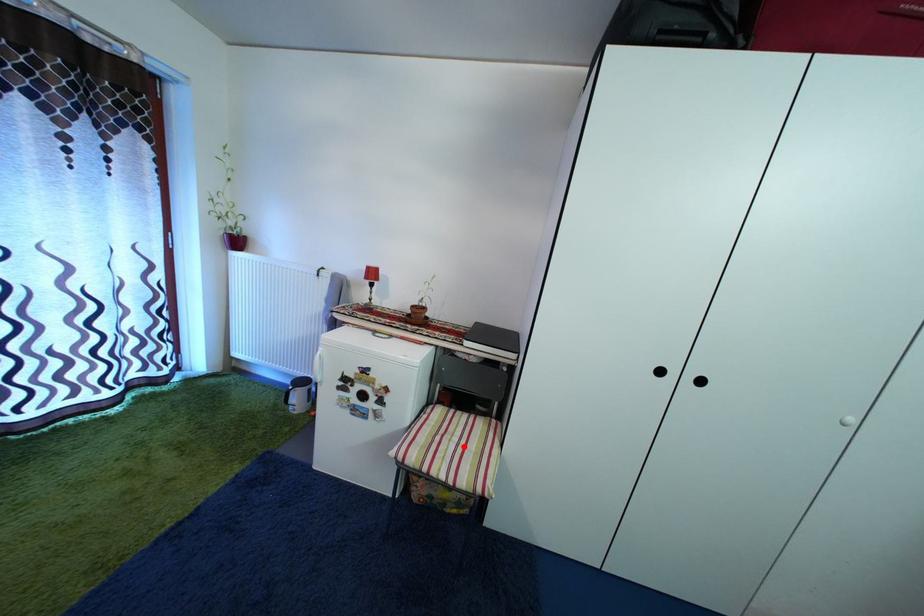
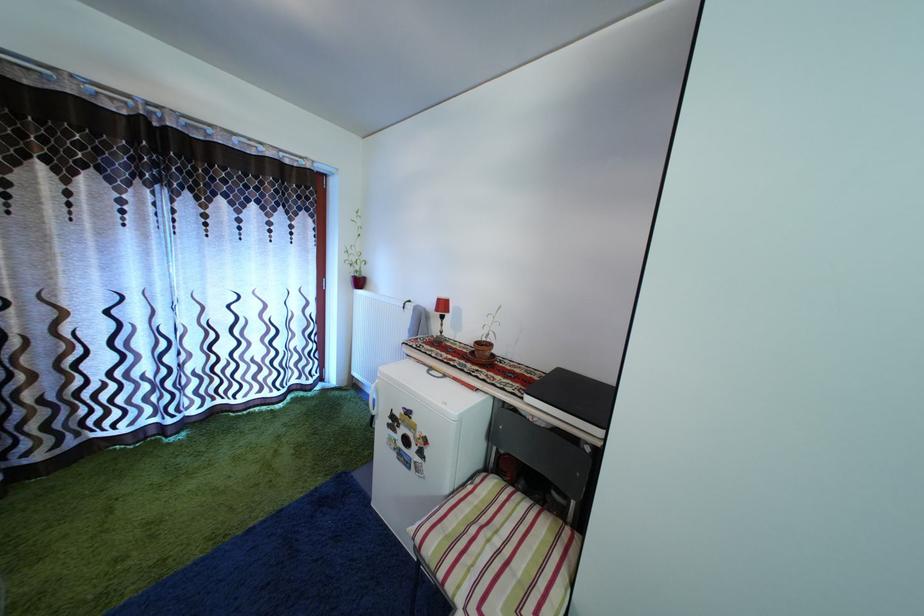
Where in the second image is the point corresponding to the highlighted location from the first image?

(505, 549)